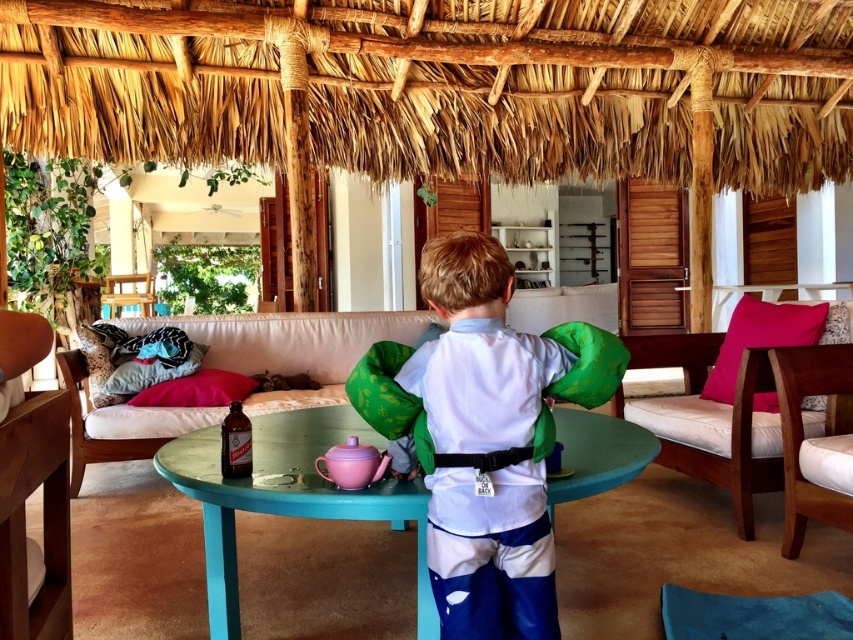
You are a guest in this rustic living space and want to sit on the white fabric couch at center. However, there is a white fabric shirt at center on the table. Which object is taller so that you can see the top of the couch?

The white fabric shirt at center is taller than the white fabric couch at center, so you cannot see the top of the couch because the shirt is blocking your view.

You are a guest in this living room and want to sit on the white fabric couch at right. However, there is a pink fabric pillow at right in your way. Can you move the pillow to sit down?

The white fabric couch at right is closer to the viewer than the pink fabric pillow at right, so the pillow is actually behind the couch and not in your way. You can sit down without moving the pillow.